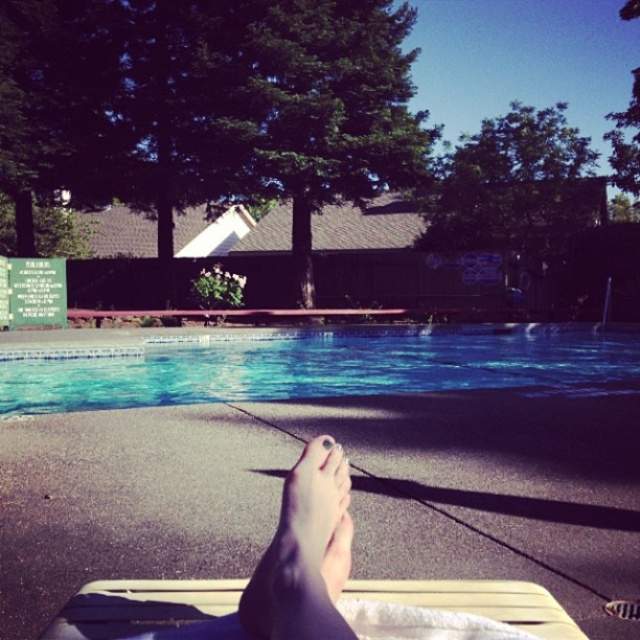
You are sitting on the lounge chair and want to reach the point at coordinates point (563, 342) and point (332, 444). Which point is closer to your current position?

Point (332, 444) is closer to your current position because it is in front of point (563, 342), which is behind it.

You are planning to take a photo of the clear blue water at center and the matte skin toe at center from the pool deck. Which object should you focus on first if you want to capture both in one shot without moving the camera?

The clear blue water at center should be focused on first because its width is larger than the matte skin toe at center, making it the dominant subject in the frame.

You are a photographer taking a closeup of the pale skin at center and the matte skin toe at center. Which object is closer to the camera?

The matte skin toe at center is closer to the camera because it is casting a shadow over the pale skin at center.